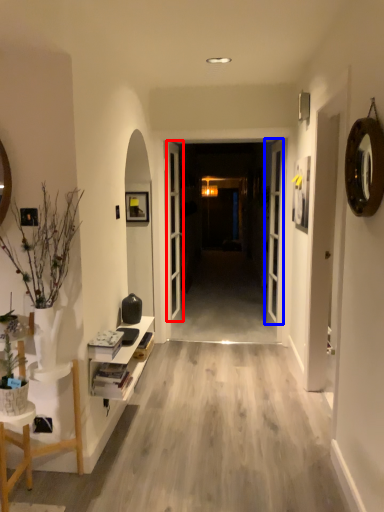
Question: Which of the following is the farthest to the observer, door (highlighted by a red box) or door (highlighted by a blue box)?

Choices:
 (A) door
 (B) door

Answer: (A)